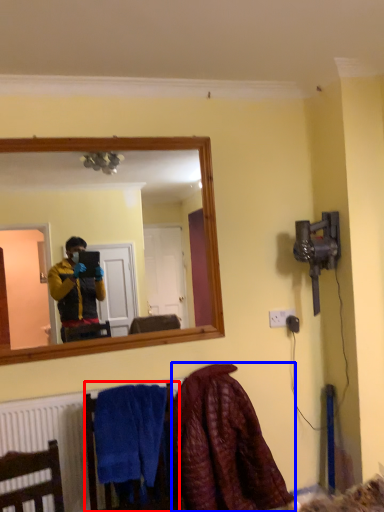
Question: Which point is closer to the camera, armchair (highlighted by a red box) or blanket (highlighted by a blue box)?

Choices:
 (A) armchair
 (B) blanket

Answer: (A)